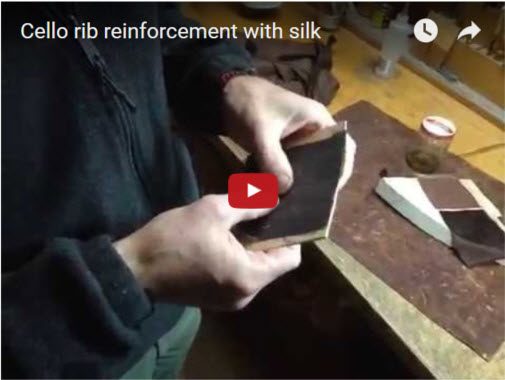
At what (x,y) coordinates should I click in order to perform the action: click on glass. Please return your answer as a coordinate pair (x, y). The height and width of the screenshot is (380, 505). Looking at the image, I should click on (424, 147).